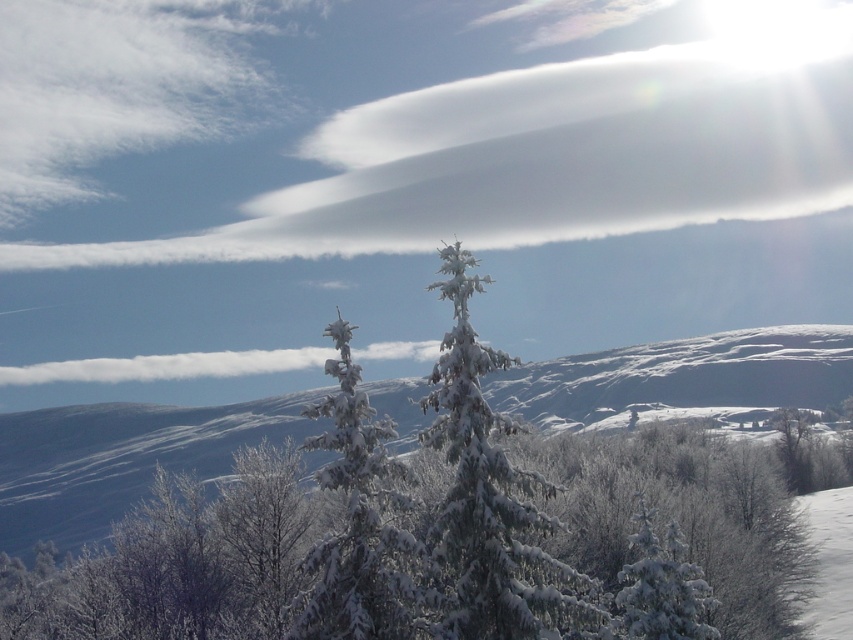
You are a photographer planning to capture the white fluffy cloud at upper center in your shot. Given that your camera can focus on objects up to 600 feet away, will the cloud be in focus?

The white fluffy cloud at upper center is 612.45 feet away from the camera, which exceeds the camera focus limit of 600 feet. Therefore, the cloud will not be in focus.